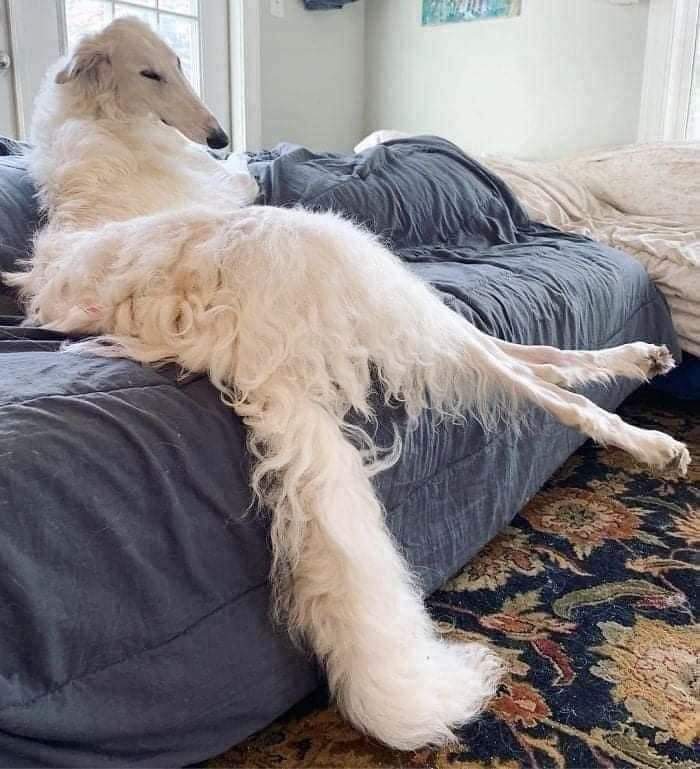
Identify the location of couch. (101, 546).